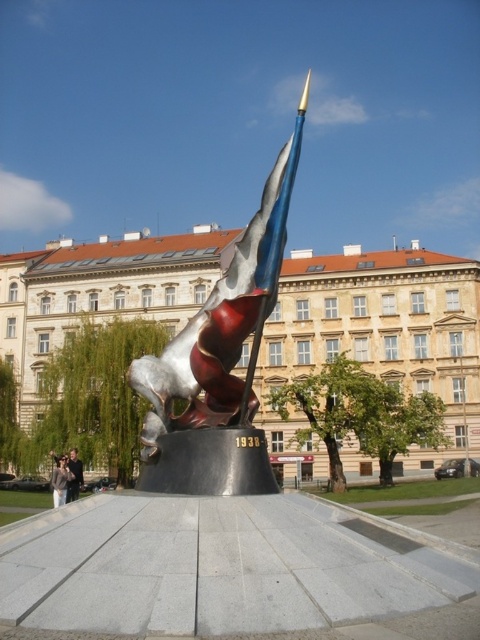
You are a photographer standing in front of the sculpture and you want to take a photo of the light brown leather jacket at lower left and dark blue jeans at lower left. Which object should you zoom in on to capture more details?

The light brown leather jacket at lower left is much taller than the dark blue jeans at lower left, so you should zoom in on the light brown leather jacket at lower left to capture more details.

You are an architect designing a new plaza and want to ensure the new sculpture will fit between the existing metallic building at center and the existing metallic sculpture at center. What should you consider about their widths?

You should consider the width of the metallic building at center and the metallic sculpture at center because the metallic building at center might be wider than the metallic sculpture at center, so the sculpture must be placed accordingly to ensure proper spacing.